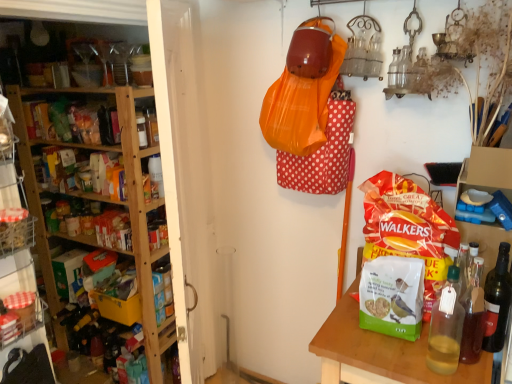
Locate an element on the screen. Image resolution: width=512 pixels, height=384 pixels. vacant space to the left of translucent glass bottle at right, marked as the 1th bottle in a left-to-right arrangement is located at coordinates (378, 355).